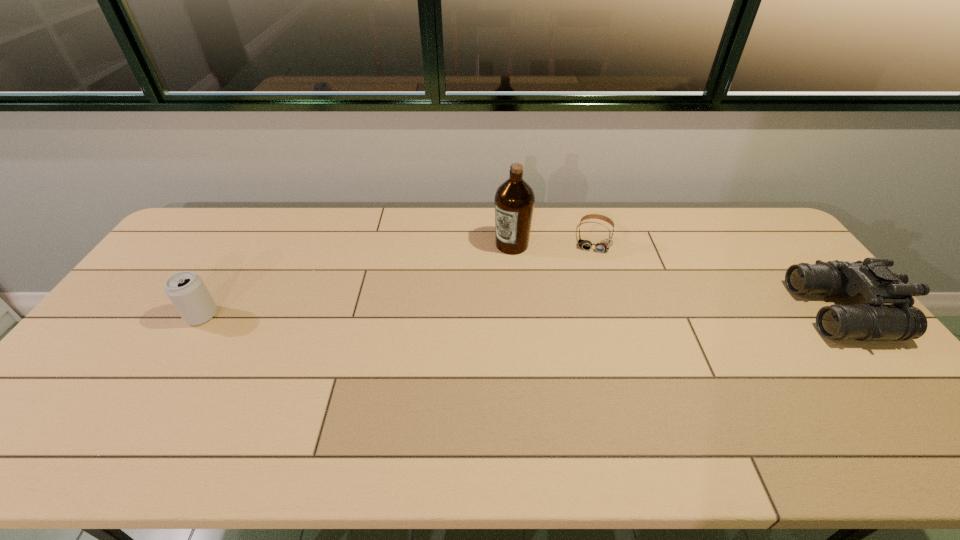
Locate an element on the screen. vacant space on the desktop that is between the can and the rightmost object and is positioned on the label of the tallest object is located at coordinates (439, 314).

Identify the location of vacant space on the desktop that is between the leftmost object and the binoculars and is positioned on the front-facing side of the shortest object. The height and width of the screenshot is (540, 960). (584, 313).